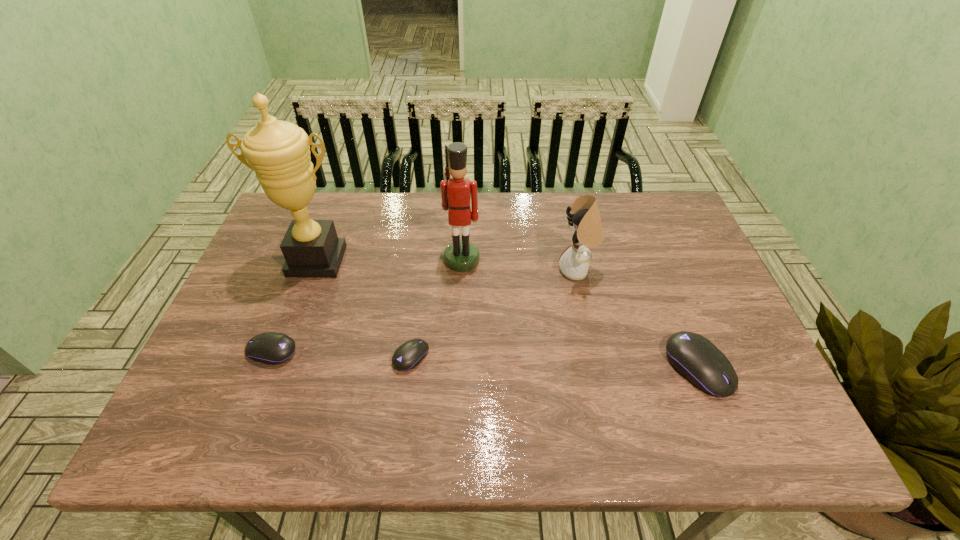
Locate an element on the screen. vacant space that's between the tallest computer mouse and the leftmost computer mouse is located at coordinates (485, 360).

I want to click on empty space between the tallest object and the second tallest object, so click(390, 260).

At what (x,y) coordinates should I click in order to perform the action: click on free space between the fourth tallest object and the tallest object. Please return your answer as a coordinate pair (x, y). The width and height of the screenshot is (960, 540). Looking at the image, I should click on (508, 314).

Locate an element on the screen. The height and width of the screenshot is (540, 960). blank region between the fifth tallest object and the second tallest object is located at coordinates (367, 306).

Locate an element on the screen. empty space that is in between the trophy cup and the third object from right to left is located at coordinates (390, 260).

The height and width of the screenshot is (540, 960). I want to click on empty location between the nutcracker and the rightmost object, so click(x=580, y=314).

At what (x,y) coordinates should I click in order to perform the action: click on free space between the second shortest computer mouse and the nutcracker. Please return your answer as a coordinate pair (x, y). The height and width of the screenshot is (540, 960). Looking at the image, I should click on (367, 306).

This screenshot has width=960, height=540. I want to click on free spot between the second object from right to left and the nutcracker, so click(519, 265).

The width and height of the screenshot is (960, 540). Identify the location of free area in between the nutcracker and the trophy cup. (390, 260).

This screenshot has width=960, height=540. Find the location of `unoccupied area between the fourth object from right to left and the second shortest computer mouse`. unoccupied area between the fourth object from right to left and the second shortest computer mouse is located at coordinates (342, 354).